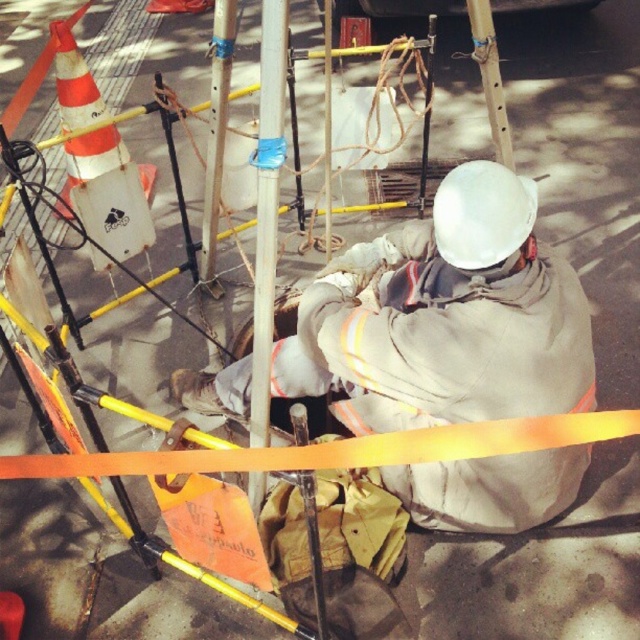
Question: Estimate the real-world distances between objects in this image. Which object is closer to the gray fabric construction worker at center?

Choices:
 (A) orange reflective traffic cone at upper left
 (B) blue tape on metal pole at center
 (C) smooth white pole at center

Answer: (B)

Question: Which of the following is the farthest from the observer?

Choices:
 (A) (61, 72)
 (B) (497, 163)
 (C) (209, 161)

Answer: (A)

Question: Is blue tape on metal pole at center bigger than orange reflective traffic cone at upper left?

Choices:
 (A) no
 (B) yes

Answer: (A)

Question: In this image, where is orange reflective traffic cone at upper left located relative to smooth white pole at center?

Choices:
 (A) right
 (B) left

Answer: (B)

Question: Based on their relative distances, which object is farther from the gray fabric construction worker at center?

Choices:
 (A) blue tape on metal pole at center
 (B) smooth white pole at center
 (C) orange reflective traffic cone at upper left

Answer: (C)

Question: Can you confirm if blue tape on metal pole at center is thinner than smooth white pole at center?

Choices:
 (A) no
 (B) yes

Answer: (B)